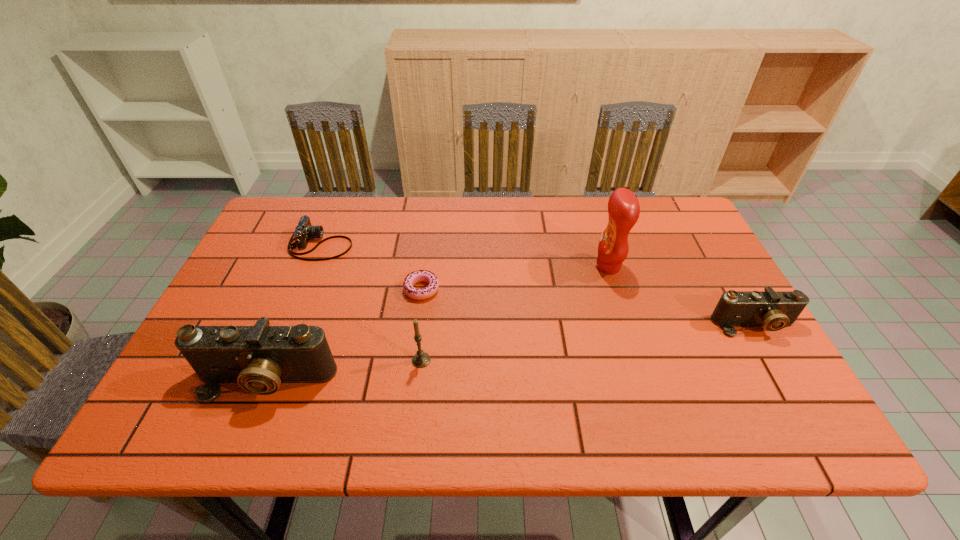
Find the location of a particular element. The height and width of the screenshot is (540, 960). object present at the far left corner is located at coordinates (304, 231).

Identify the location of object that is positioned at the near left corner. point(259,358).

You are a GUI agent. You are given a task and a screenshot of the screen. Output one action in this format:
    pyautogui.click(x=<x>, y=<y>)
    Task: Click on the vacant region at the far edge
    
    Given the screenshot: What is the action you would take?
    pyautogui.click(x=600, y=202)

In the image, there is a desktop. Where is `vacant space at the near edge`? The height and width of the screenshot is (540, 960). vacant space at the near edge is located at coordinates (390, 379).

Where is `vacant region at the right edge`? Image resolution: width=960 pixels, height=540 pixels. vacant region at the right edge is located at coordinates (689, 289).

In the image, there is a desktop. Where is `vacant space at the far right corner`? vacant space at the far right corner is located at coordinates (660, 240).

Find the location of a particular element. free space at the near right corner of the desktop is located at coordinates (787, 389).

Find the location of `empty space that is in between the farthest camera and the shortest object`. empty space that is in between the farthest camera and the shortest object is located at coordinates (372, 267).

Locate an element on the screen. empty space between the farthest camera and the second farthest camera is located at coordinates (538, 285).

At what (x,y) coordinates should I click in order to perform the action: click on free space between the shortest object and the rightmost object. Please return your answer as a coordinate pair (x, y). This screenshot has width=960, height=540. Looking at the image, I should click on (588, 307).